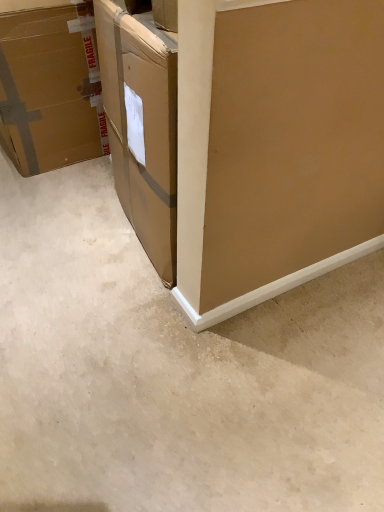
Question: Is brown cardboard box at left inside beige carpet at lower left?

Choices:
 (A) yes
 (B) no

Answer: (B)

Question: Is beige carpet at lower left behind brown cardboard box at left?

Choices:
 (A) no
 (B) yes

Answer: (A)

Question: From a real-world perspective, is beige carpet at lower left on top of brown cardboard box at left?

Choices:
 (A) yes
 (B) no

Answer: (B)

Question: Is beige carpet at lower left outside brown cardboard box at left?

Choices:
 (A) no
 (B) yes

Answer: (B)

Question: From the image's perspective, is beige carpet at lower left above brown cardboard box at left?

Choices:
 (A) no
 (B) yes

Answer: (A)

Question: Does beige carpet at lower left have a smaller size compared to brown cardboard box at left?

Choices:
 (A) yes
 (B) no

Answer: (A)

Question: Considering the relative positions of brown cardboard box at left and beige carpet at lower left in the image provided, is brown cardboard box at left behind beige carpet at lower left?

Choices:
 (A) yes
 (B) no

Answer: (A)

Question: Is brown cardboard box at left in contact with beige carpet at lower left?

Choices:
 (A) yes
 (B) no

Answer: (B)

Question: Does brown cardboard box at left appear on the right side of beige carpet at lower left?

Choices:
 (A) yes
 (B) no

Answer: (B)

Question: Can you confirm if brown cardboard box at left is shorter than beige carpet at lower left?

Choices:
 (A) yes
 (B) no

Answer: (B)

Question: Can you confirm if brown cardboard box at left is taller than beige carpet at lower left?

Choices:
 (A) yes
 (B) no

Answer: (A)

Question: Is brown cardboard box at left facing away from beige carpet at lower left?

Choices:
 (A) no
 (B) yes

Answer: (A)

Question: From a real-world perspective, is beige carpet at lower left above or below brown cardboard box at left?

Choices:
 (A) above
 (B) below

Answer: (B)